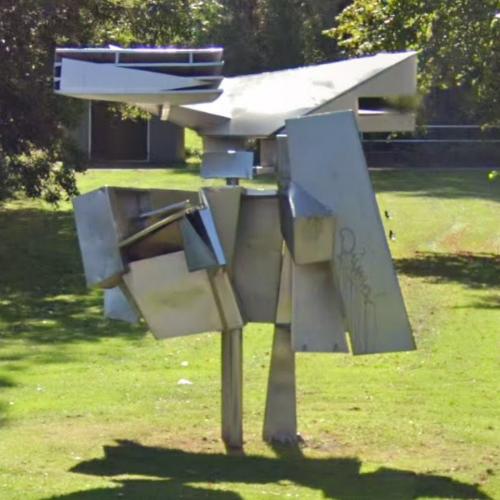
Locate an element on the screen. This screenshot has width=500, height=500. window is located at coordinates coord(371,110).